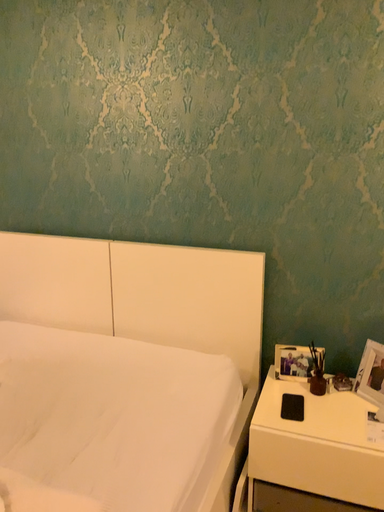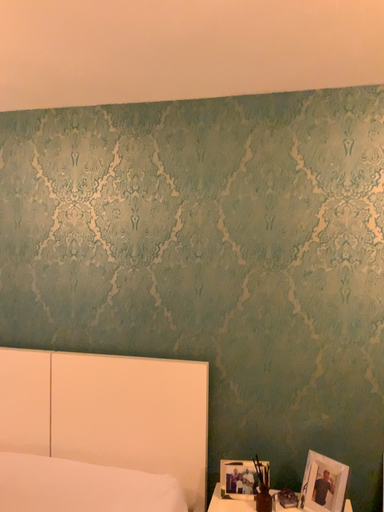
Question: Which way did the camera rotate in the video?

Choices:
 (A) rotated right
 (B) rotated left

Answer: (A)